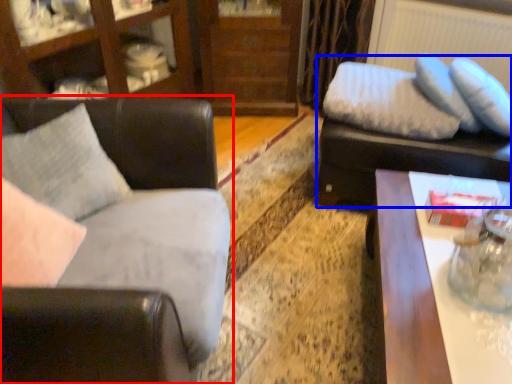
Question: Which object appears farthest to the camera in this image, studio couch (highlighted by a red box) or swivel chair (highlighted by a blue box)?

Choices:
 (A) studio couch
 (B) swivel chair

Answer: (B)